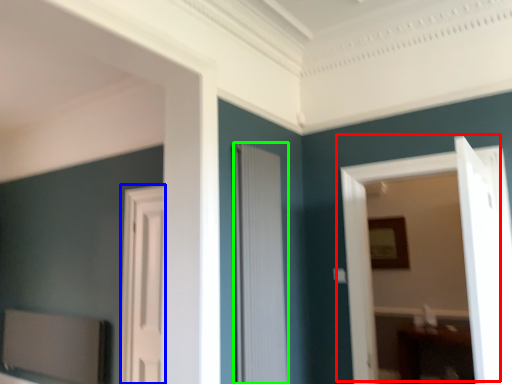
Question: Considering the real-world distances, which object is farthest from door (highlighted by a red box)? door (highlighted by a blue box) or door (highlighted by a green box)?

Choices:
 (A) door
 (B) door

Answer: (A)